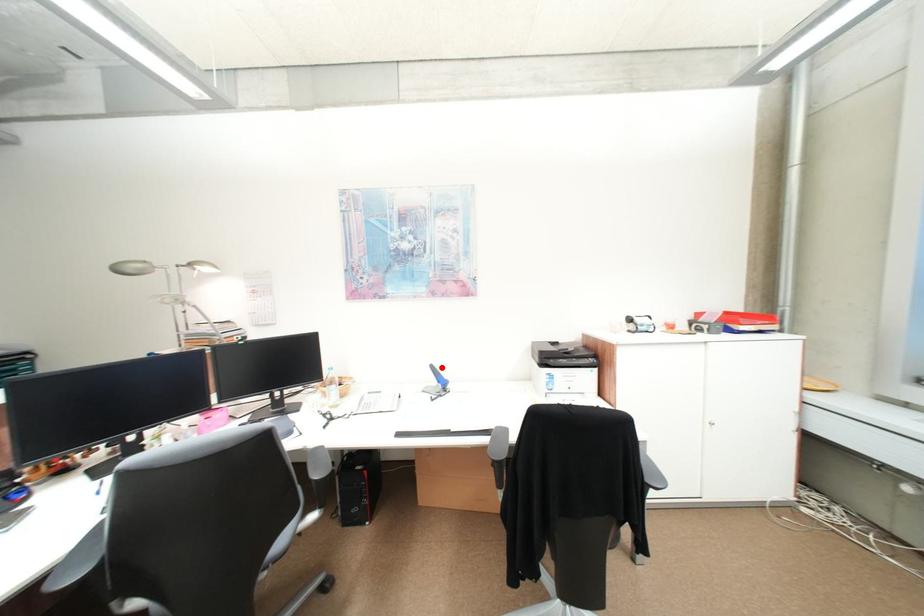
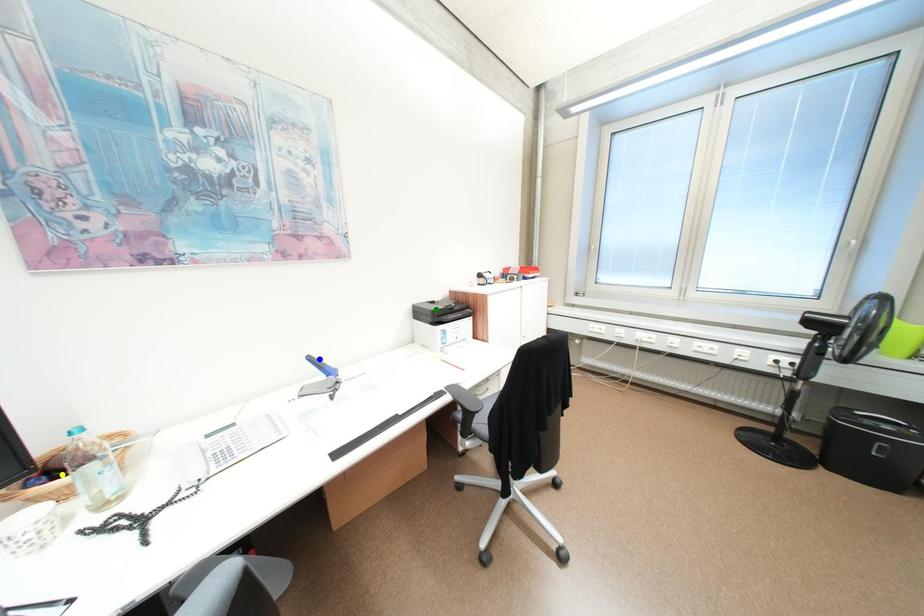
Question: I am providing you with two images of the same scene from different viewpoints. A red point is marked on the first image. You are given multiple points on the second image. Which mark in image 2 goes with the point in image 1?

Choices:
 (A) green point
 (B) blue point
 (C) yellow point

Answer: (B)